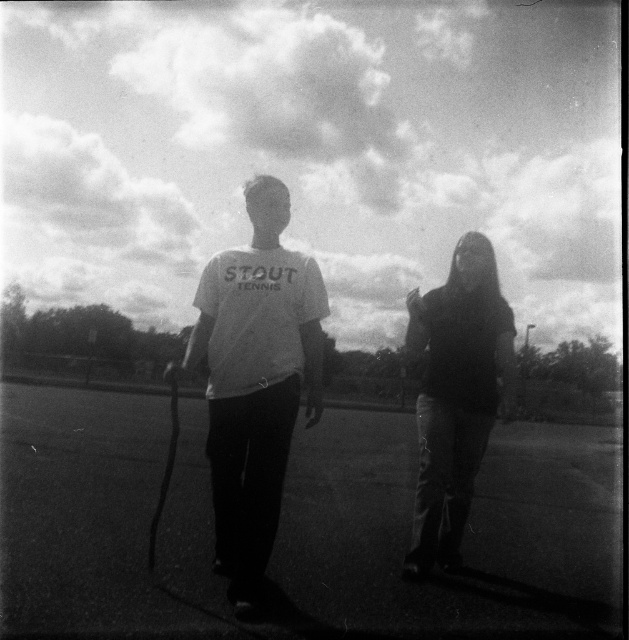
Which is above, white matte shirt at center or dark fabric jacket at center?

white matte shirt at center is higher up.

Is point (264, 280) closer to viewer compared to point (464, 234)?

Yes, point (264, 280) is in front of point (464, 234).

This screenshot has height=640, width=629. Identify the location of white matte shirt at center. (255, 380).